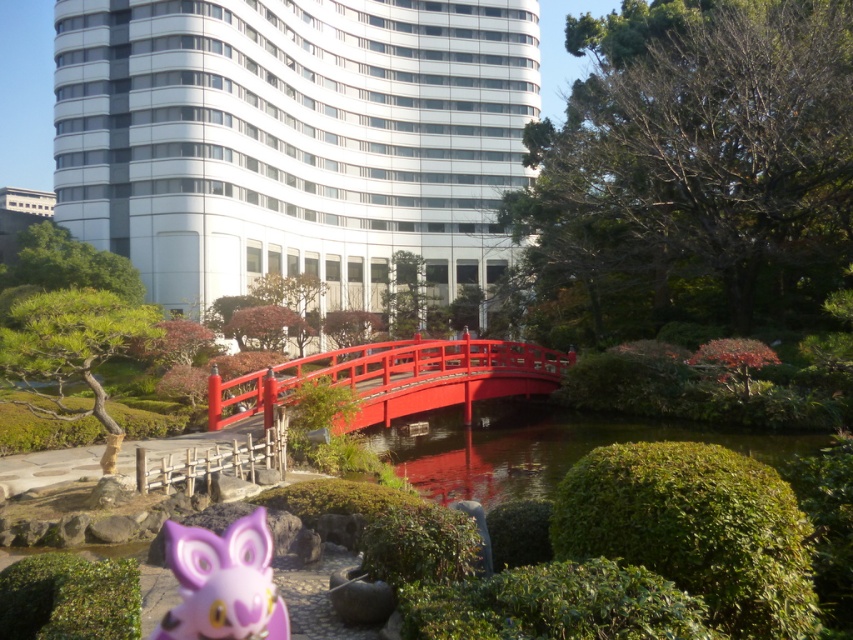
You are a photographer planning to take a photo of the green glossy pond at center and the purple matte plush toy at lower left. Which object should you focus on first if you want to ensure both are in sharp focus?

You should focus on the green glossy pond at center first because it is much taller than the purple matte plush toy at lower left, so its larger size will require more precise focus to capture details clearly.